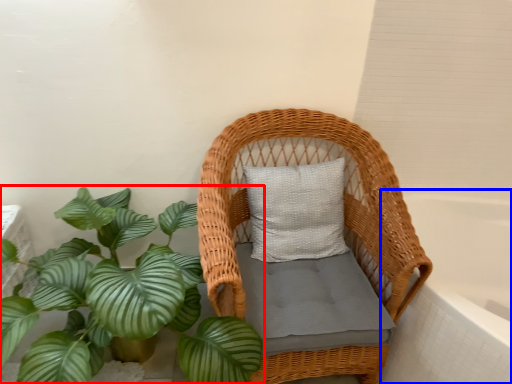
Question: Which point is closer to the camera, houseplant (highlighted by a red box) or bath (highlighted by a blue box)?

Choices:
 (A) houseplant
 (B) bath

Answer: (A)